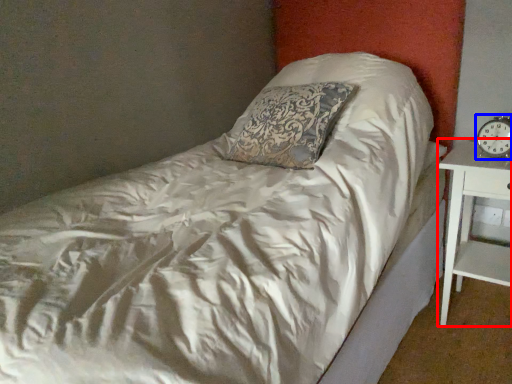
Question: Which point is closer to the camera, nightstand (highlighted by a red box) or clock (highlighted by a blue box)?

Choices:
 (A) nightstand
 (B) clock

Answer: (A)